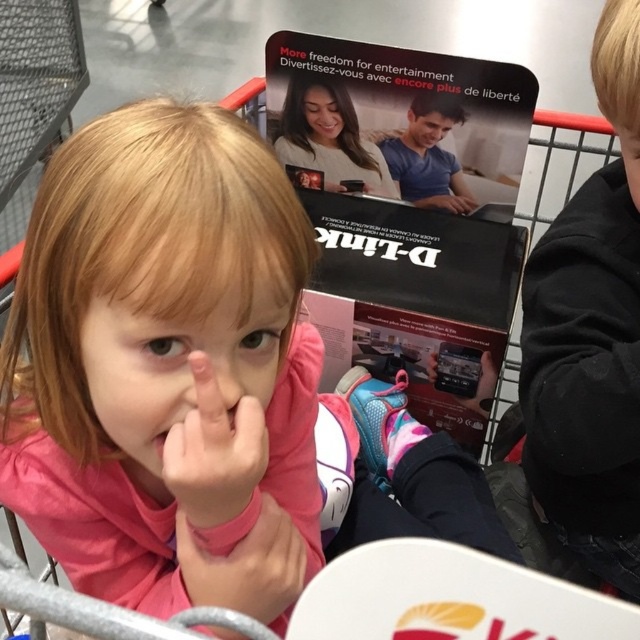
You are a delivery person who needs to ensure the items in the shopping cart are arranged properly. The pink matte hand at center and the smooth skin girl at center are part of a promotional display. Which object is wider?

The smooth skin girl at center is wider than the pink matte hand at center.

You are a photographer trying to capture the perfect shot of the two points in the shopping cart scene. Which point, point (550, 227) or point (406, 129), will appear larger in the photo due to its position relative to the camera?

Point (550, 227) will appear larger in the photo because it is closer to the camera than point (406, 129).